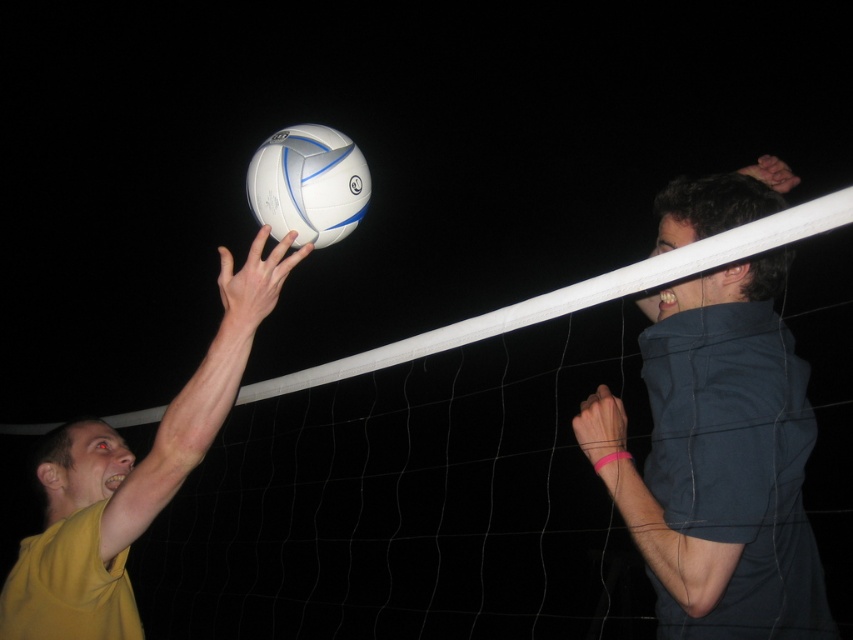
You are standing in the volleyball court and see the point at coordinates (726, 628). If you want to throw a ball to that point, will it land within the court? Please explain your reasoning based on the scene description.

The point at coordinates (726, 628) is 1.25 meters away from you. Since the volleyball court is typically 9 meters wide and 18 meters long, and the point is within the court boundaries, the ball will land within the court.

Looking at this image, you are a photographer trying to capture the volleyball game. The yellow matte shirt at upper left is represented by point (131, 476). Where should you position your camera to ensure the yellow matte shirt at upper left is centered in your shot?

To center the yellow matte shirt at upper left represented by point (131, 476), position the camera so that the point is at the center of the frame.